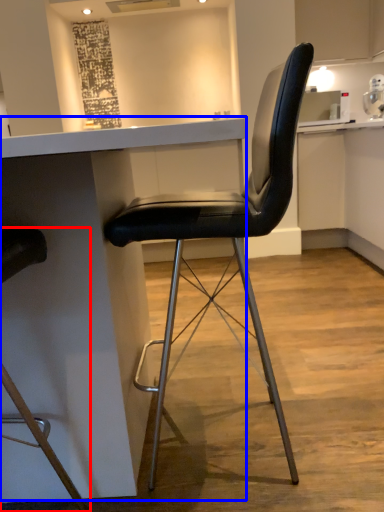
Question: Which object is closer to the camera taking this photo, chair (highlighted by a red box) or table (highlighted by a blue box)?

Choices:
 (A) chair
 (B) table

Answer: (A)